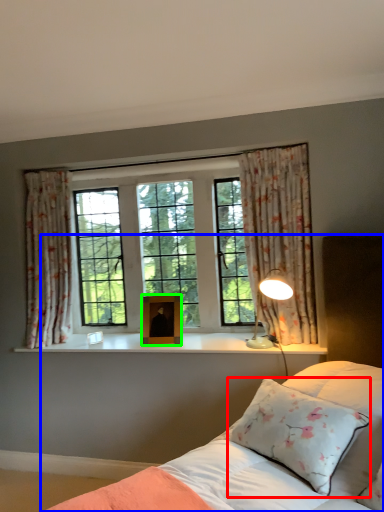
Question: Based on their relative distances, which object is farther from pillow (highlighted by a red box)? Choose from bed (highlighted by a blue box) and picture frame (highlighted by a green box).

Choices:
 (A) bed
 (B) picture frame

Answer: (B)